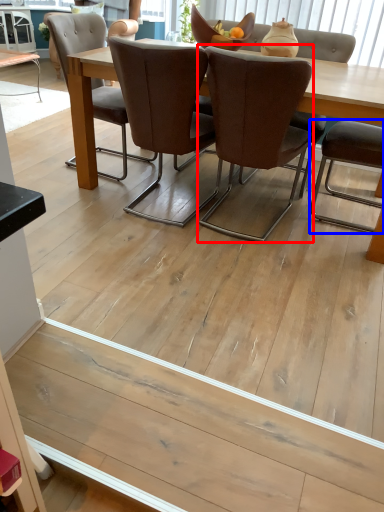
Question: Which of the following is the closest to the observer, chair (highlighted by a red box) or chair (highlighted by a blue box)?

Choices:
 (A) chair
 (B) chair

Answer: (A)